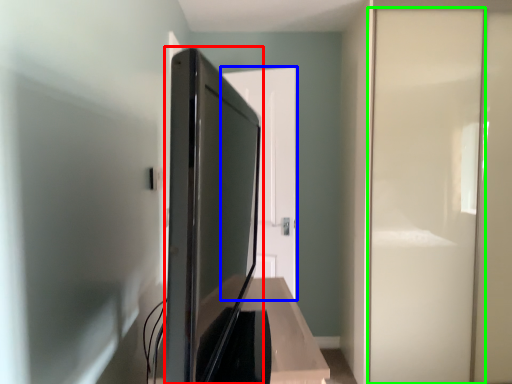
Question: Based on their relative distances, which object is farther from appliance (highlighted by a red box)? Choose from door (highlighted by a blue box) and screen door (highlighted by a green box).

Choices:
 (A) door
 (B) screen door

Answer: (B)